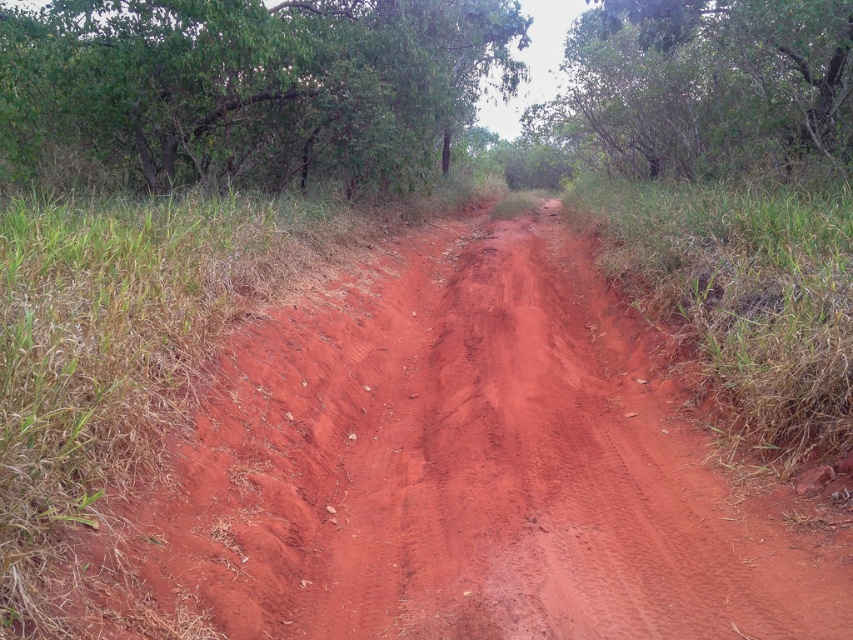
You are standing at the start of the path and want to reach a point marked by the coordinates given. Which of the two points, point (422,259) or point (683,125), is closer to you as you begin your journey along the path?

Point (422,259) is closer to the camera than point (683,125), so it is closer to you as you begin your journey along the path.

You are standing at the entrance of a forest and see the dusty red dirt track at center. If you want to reach a point exactly at coordinate 0.736, 0.531, which object should you follow?

The dusty red dirt track at center is located at point (451, 470), so you should follow the dusty red dirt track at center to reach that coordinate.

You are a hiker trying to determine which tree has a wider spread. You see a green leafy tree at upper left and a green leafy tree at upper center in the image. Which one has a larger width?

The green leafy tree at upper left has a larger width than the green leafy tree at upper center.